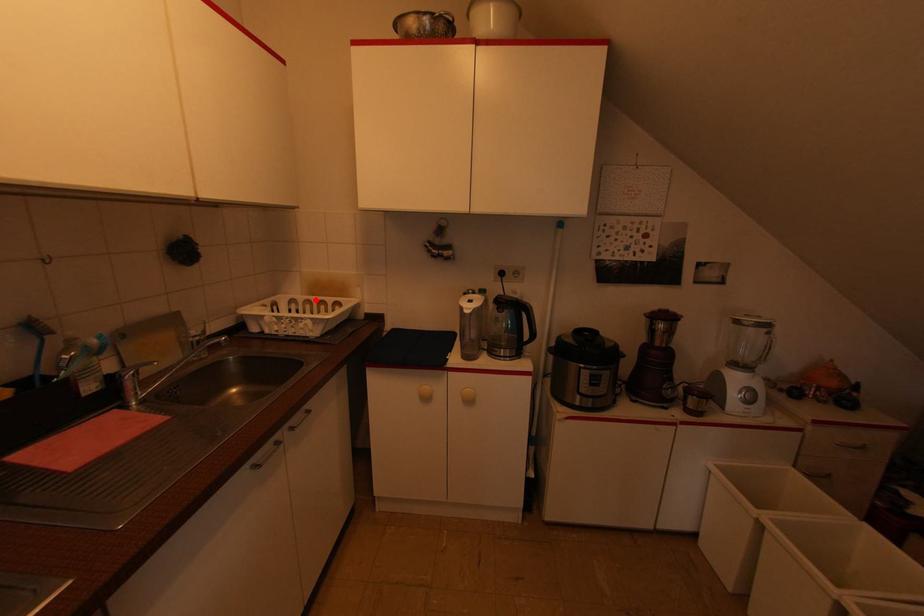
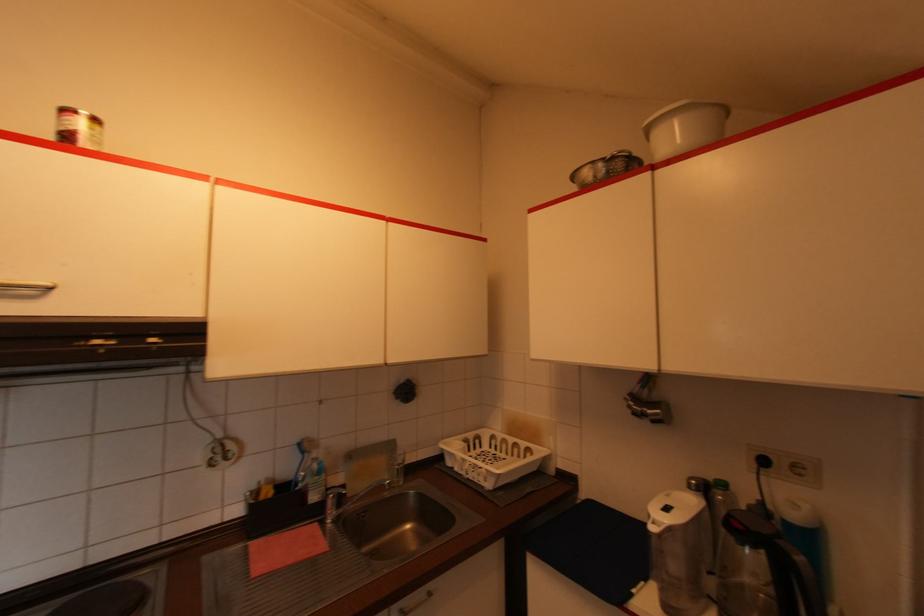
Find the pixel in the second image that matches the highlighted location in the first image.

(512, 440)